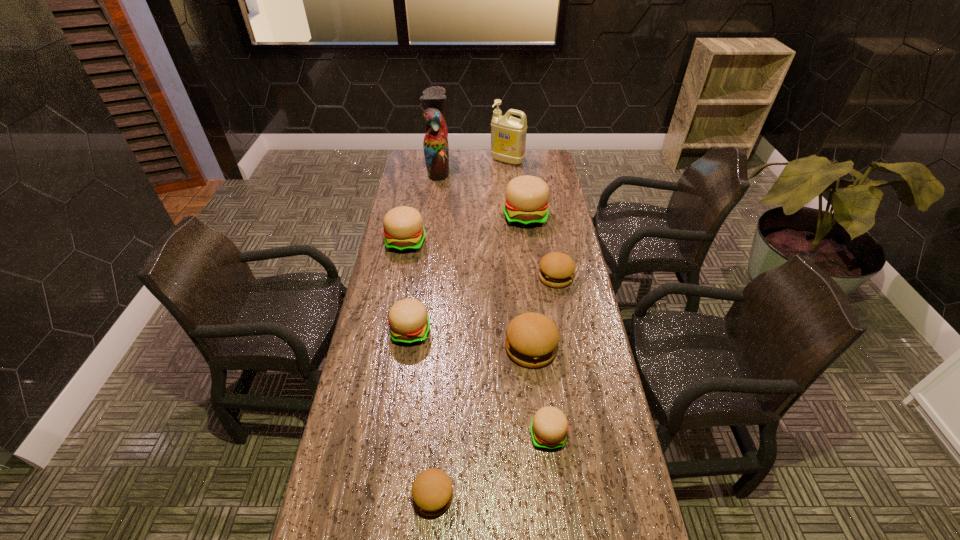
I want to click on the third farthest hamburger, so click(x=557, y=269).

Find the location of a particular element. This screenshot has height=540, width=960. the second nearest object is located at coordinates (549, 427).

Identify the location of the nearest beige hamburger. The image size is (960, 540). (549, 427).

Find the location of a particular element. Image resolution: width=960 pixels, height=540 pixels. the shortest object is located at coordinates (432, 492).

Identify the location of the nearest hamburger. The height and width of the screenshot is (540, 960). (432, 492).

Locate an element on the screen. Image resolution: width=960 pixels, height=540 pixels. vacant area located at the face of the tallest object is located at coordinates (516, 167).

Locate an element on the screen. The height and width of the screenshot is (540, 960). free space located on the front of the detergent is located at coordinates (511, 194).

Identify the location of free space located 0.310m on the back of the biggest beige hamburger. The image size is (960, 540). (519, 167).

The image size is (960, 540). What are the coordinates of `free space located 0.140m on the front of the sixth shortest hamburger` in the screenshot? It's located at (398, 281).

Identify the location of vacant space located 0.060m on the front of the third biggest beige hamburger. Image resolution: width=960 pixels, height=540 pixels. (406, 364).